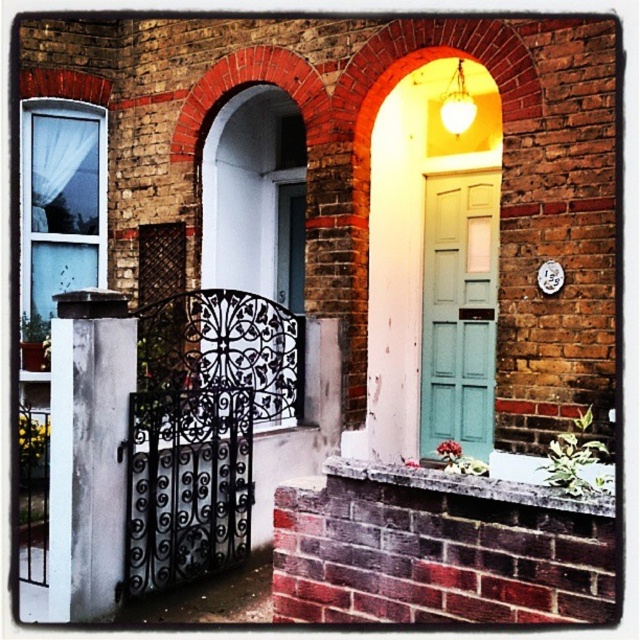
Question: Is teal matte door at center above smooth white door at center?

Choices:
 (A) yes
 (B) no

Answer: (B)

Question: Is teal matte door at center wider than smooth white door at center?

Choices:
 (A) no
 (B) yes

Answer: (A)

Question: In this image, where is teal matte door at center located relative to smooth white door at center?

Choices:
 (A) below
 (B) above

Answer: (A)

Question: Among these objects, which one is farthest from the camera?

Choices:
 (A) teal matte door at center
 (B) smooth white door at center

Answer: (A)